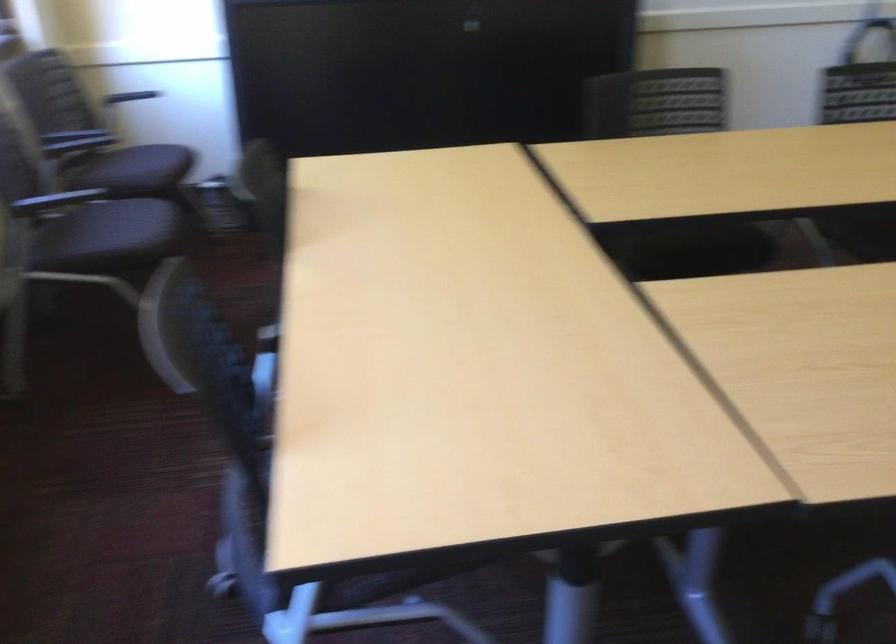
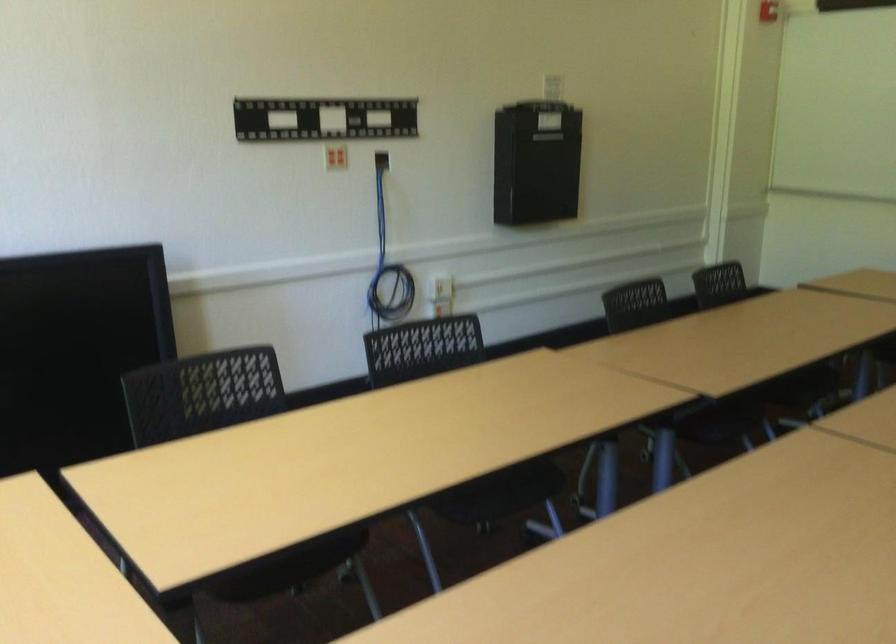
Question: The camera is either moving clockwise (left) or counter-clockwise (right) around the object. The first image is from the beginning of the video and the second image is from the end. Is the camera moving left or right when shooting the video?

Choices:
 (A) Left
 (B) Right

Answer: (A)